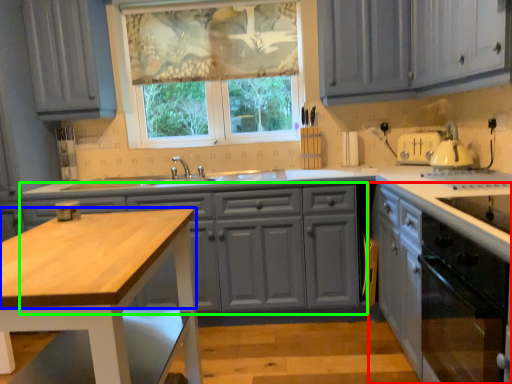
Question: Based on their relative distances, which object is farther from cabinetry (highlighted by a red box)? Choose from countertop (highlighted by a blue box) and cabinetry (highlighted by a green box).

Choices:
 (A) countertop
 (B) cabinetry

Answer: (A)